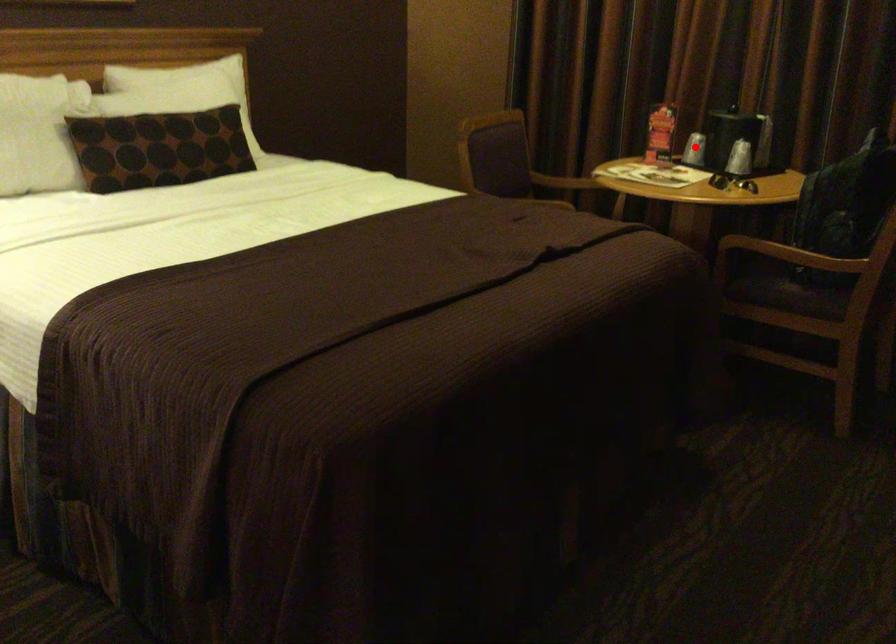
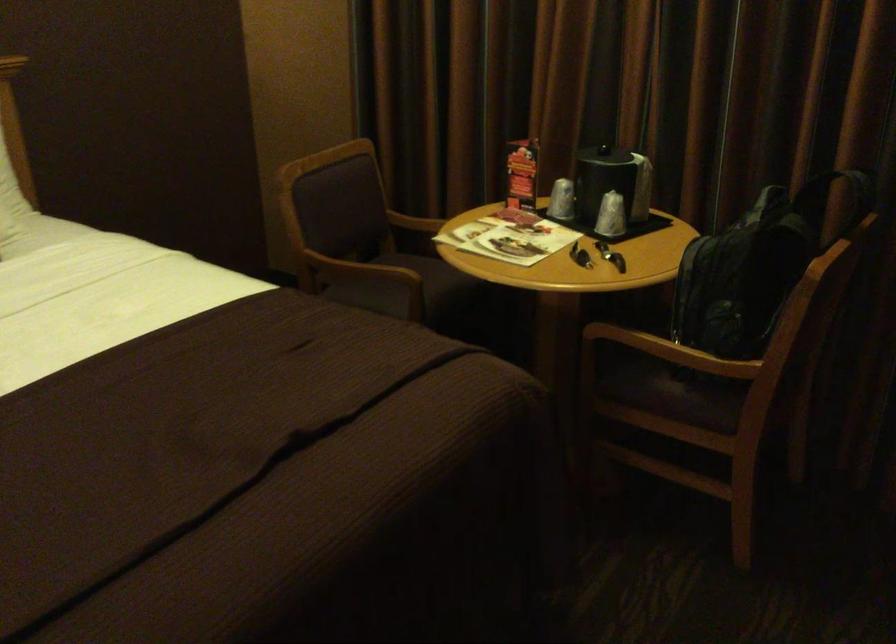
Question: I am providing you with two images of the same scene from different viewpoints. Given a red point in image1, look at the same physical point in image2. Is it:

Choices:
 (A) Closer to the viewpoint
 (B) Farther from the viewpoint

Answer: (A)